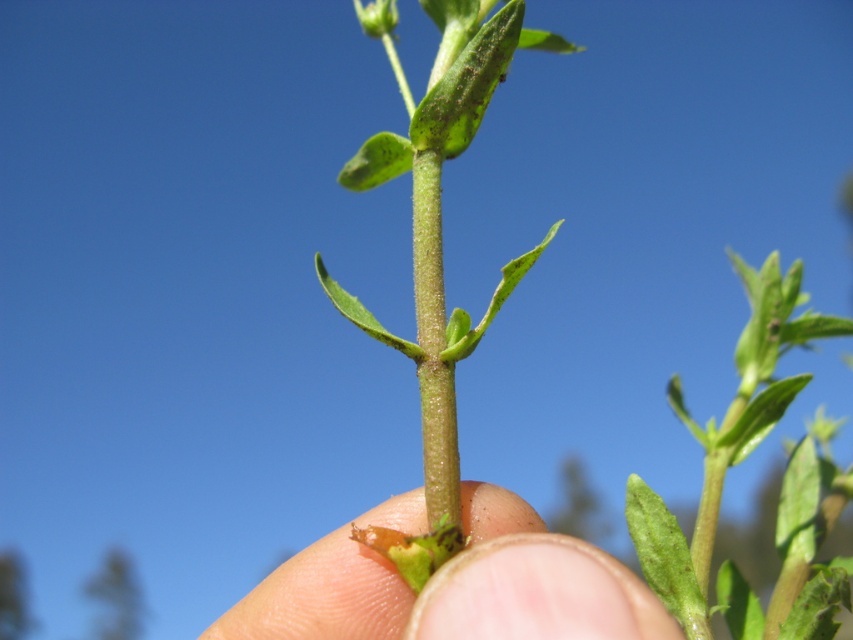
Question: Which object is farther from the camera taking this photo?

Choices:
 (A) smooth skin at center
 (B) green matte leaf at center

Answer: (B)

Question: Which point is closer to the camera?

Choices:
 (A) smooth skin at center
 (B) green matte leaf at center

Answer: (A)

Question: Can you confirm if smooth skin at center is positioned to the right of green matte leaf at center?

Choices:
 (A) no
 (B) yes

Answer: (A)

Question: Does smooth skin at center lie behind green matte leaf at center?

Choices:
 (A) yes
 (B) no

Answer: (B)

Question: Does smooth skin at center have a lesser width compared to green matte leaf at center?

Choices:
 (A) yes
 (B) no

Answer: (B)